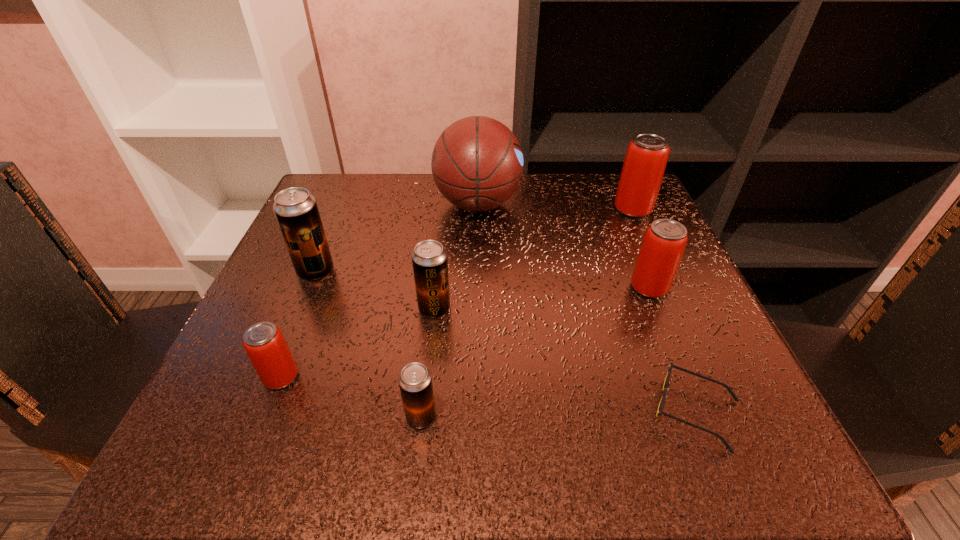
At what (x,y) coordinates should I click in order to perform the action: click on vacant space located 0.110m on the lenses of the black sunglasses. Please return your answer as a coordinate pair (x, y). The image size is (960, 540). Looking at the image, I should click on (569, 411).

You are a GUI agent. You are given a task and a screenshot of the screen. Output one action in this format:
    pyautogui.click(x=<x>, y=<y>)
    Task: Click on the free space located on the lenses of the black sunglasses
    This screenshot has width=960, height=540.
    Given the screenshot: What is the action you would take?
    pyautogui.click(x=526, y=411)

This screenshot has width=960, height=540. Find the location of `vacant space located on the lenses of the black sunglasses`. vacant space located on the lenses of the black sunglasses is located at coordinates (483, 411).

Find the location of a particular element. basketball situated at the far edge is located at coordinates [477, 163].

Identify the location of beer can located at the far edge. (647, 154).

Image resolution: width=960 pixels, height=540 pixels. Find the location of `beer can at the near edge`. beer can at the near edge is located at coordinates (415, 381).

Where is `sunglasses positioned at the near edge`? The width and height of the screenshot is (960, 540). sunglasses positioned at the near edge is located at coordinates (659, 412).

The width and height of the screenshot is (960, 540). I want to click on sunglasses located in the right edge section of the desktop, so click(x=659, y=412).

This screenshot has height=540, width=960. In order to click on object located in the far right corner section of the desktop in this screenshot , I will do `click(647, 154)`.

What are the coordinates of `object that is at the near right corner` in the screenshot? It's located at (659, 412).